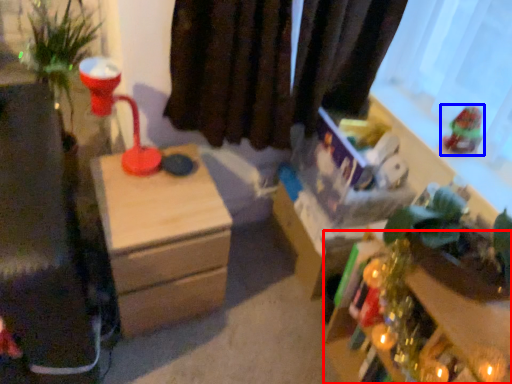
Question: Among these objects, which one is nearest to the camera, table (highlighted by a red box) or toy (highlighted by a blue box)?

Choices:
 (A) table
 (B) toy

Answer: (A)